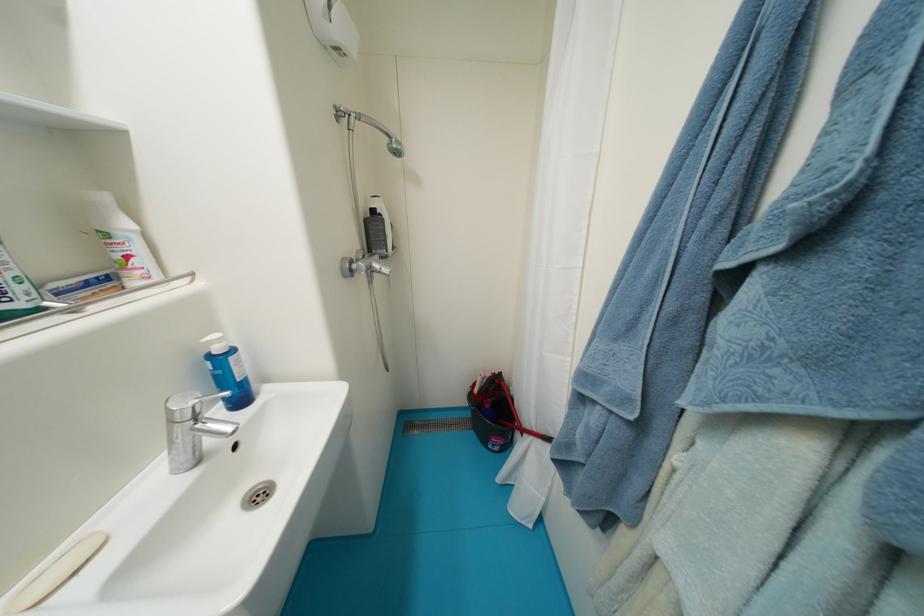
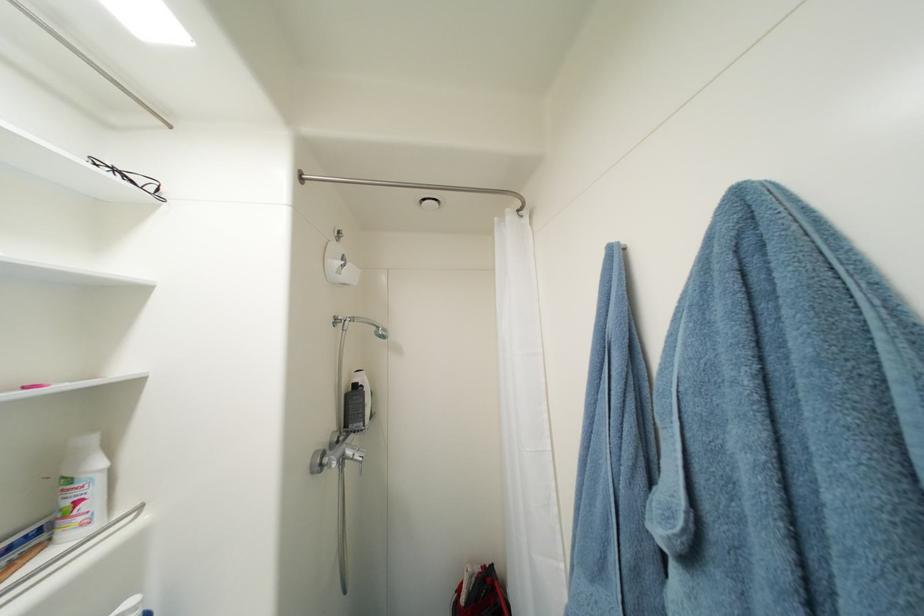
Locate, in the second image, the point that corresponds to the point at 874,161 in the first image.

(691, 515)